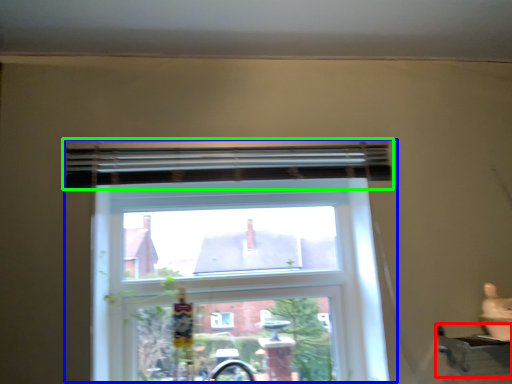
Question: Based on their relative distances, which object is nearer to window sill (highlighted by a red box)? Choose from window (highlighted by a blue box) and curtain (highlighted by a green box).

Choices:
 (A) window
 (B) curtain

Answer: (A)